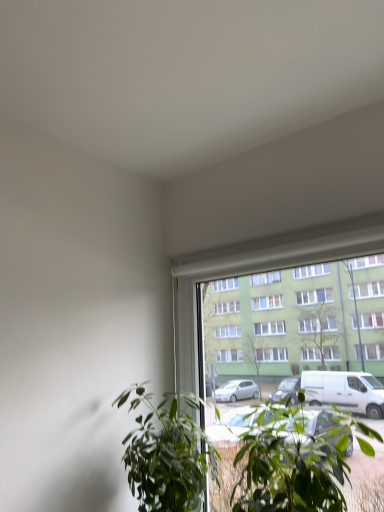
Question: Which direction should I rotate to look at green leafy plant at lower center, arranged as the first houseplant when viewed from the left?

Choices:
 (A) right
 (B) left

Answer: (B)

Question: Can you confirm if green leafy plant at lower center, the second houseplant positioned from the right, is smaller than green leafy plant at center, placed as the 2th houseplant when sorted from left to right?

Choices:
 (A) no
 (B) yes

Answer: (B)

Question: Does green leafy plant at lower center, the second houseplant positioned from the right, have a greater height compared to green leafy plant at center, which appears as the 1th houseplant when viewed from the right?

Choices:
 (A) no
 (B) yes

Answer: (B)

Question: Is green leafy plant at lower center, the second houseplant positioned from the right, completely or partially outside of green leafy plant at center, placed as the 2th houseplant when sorted from left to right?

Choices:
 (A) no
 (B) yes

Answer: (B)

Question: Is green leafy plant at lower center, the second houseplant positioned from the right, closer to camera compared to green leafy plant at center, which appears as the 1th houseplant when viewed from the right?

Choices:
 (A) no
 (B) yes

Answer: (A)

Question: Does green leafy plant at lower center, arranged as the first houseplant when viewed from the left, have a greater width compared to green leafy plant at center, which appears as the 1th houseplant when viewed from the right?

Choices:
 (A) no
 (B) yes

Answer: (A)

Question: Does green leafy plant at lower center, arranged as the first houseplant when viewed from the left, have a lesser width compared to green leafy plant at center, which appears as the 1th houseplant when viewed from the right?

Choices:
 (A) no
 (B) yes

Answer: (B)

Question: Is green leafy plant at center, placed as the 2th houseplant when sorted from left to right, behind green leafy plant at lower center, the second houseplant positioned from the right?

Choices:
 (A) no
 (B) yes

Answer: (A)

Question: Is the depth of green leafy plant at center, which appears as the 1th houseplant when viewed from the right, less than that of green leafy plant at lower center, the second houseplant positioned from the right?

Choices:
 (A) yes
 (B) no

Answer: (A)

Question: Can you confirm if green leafy plant at center, placed as the 2th houseplant when sorted from left to right, is positioned to the right of green leafy plant at lower center, arranged as the first houseplant when viewed from the left?

Choices:
 (A) yes
 (B) no

Answer: (A)

Question: From the image's perspective, is green leafy plant at center, placed as the 2th houseplant when sorted from left to right, above green leafy plant at lower center, the second houseplant positioned from the right?

Choices:
 (A) no
 (B) yes

Answer: (B)

Question: Would you say green leafy plant at center, which appears as the 1th houseplant when viewed from the right, contains green leafy plant at lower center, the second houseplant positioned from the right?

Choices:
 (A) yes
 (B) no

Answer: (B)

Question: From a real-world perspective, is green leafy plant at center, placed as the 2th houseplant when sorted from left to right, under green leafy plant at lower center, the second houseplant positioned from the right?

Choices:
 (A) yes
 (B) no

Answer: (B)

Question: Considering the positions of green leafy plant at center, which appears as the 1th houseplant when viewed from the right, and green leafy plant at lower center, the second houseplant positioned from the right, in the image, is green leafy plant at center, which appears as the 1th houseplant when viewed from the right, taller or shorter than green leafy plant at lower center, the second houseplant positioned from the right,?

Choices:
 (A) tall
 (B) short

Answer: (B)